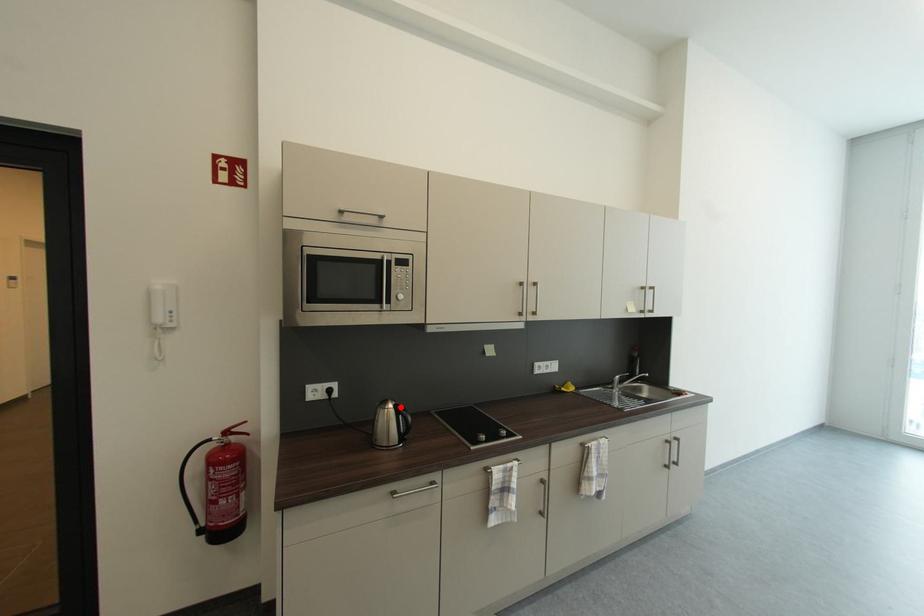
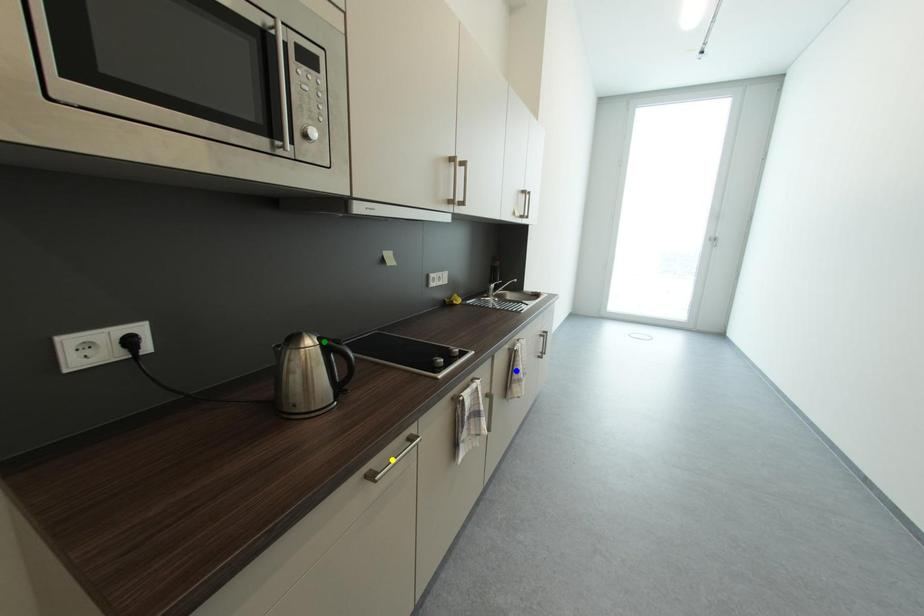
Question: I am providing you with two images of the same scene from different viewpoints. A red point is marked on the first image. You are given multiple points on the second image. Which point in image 2 is actually the same real-world point as the red point in image 1?

Choices:
 (A) blue point
 (B) yellow point
 (C) green point

Answer: (C)